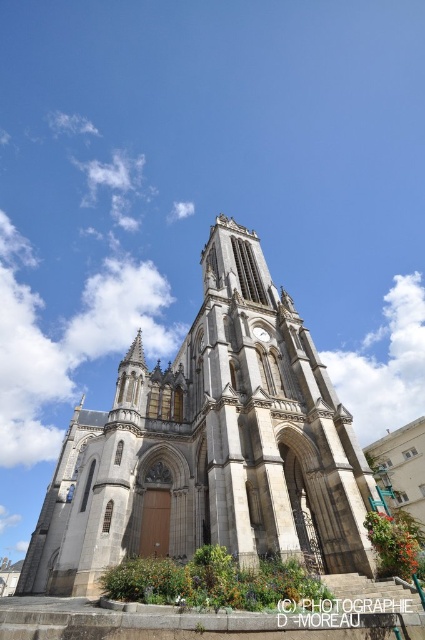
Between point (209, 408) and point (263, 333), which one is positioned behind?

The point (263, 333) is more distant.

I want to click on light gray stone church at center, so click(210, 445).

I want to click on light gray stone church at center, so click(x=210, y=445).